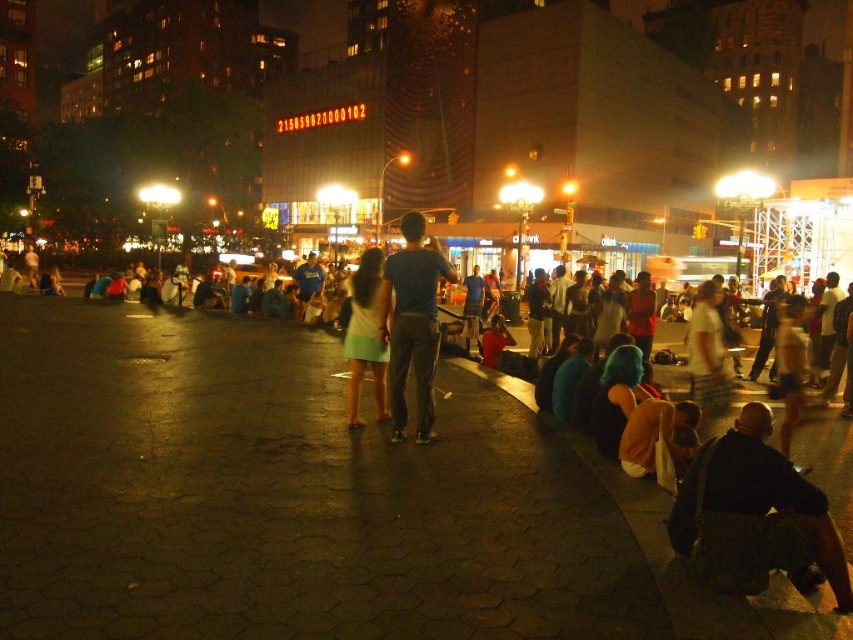
Is dark blue jeans at center thinner than light green fabric dress at center?

Yes, dark blue jeans at center is thinner than light green fabric dress at center.

Where is `dark blue jeans at center`? dark blue jeans at center is located at coordinates (412, 323).

The height and width of the screenshot is (640, 853). Find the location of `dark blue jeans at center`. dark blue jeans at center is located at coordinates (412, 323).